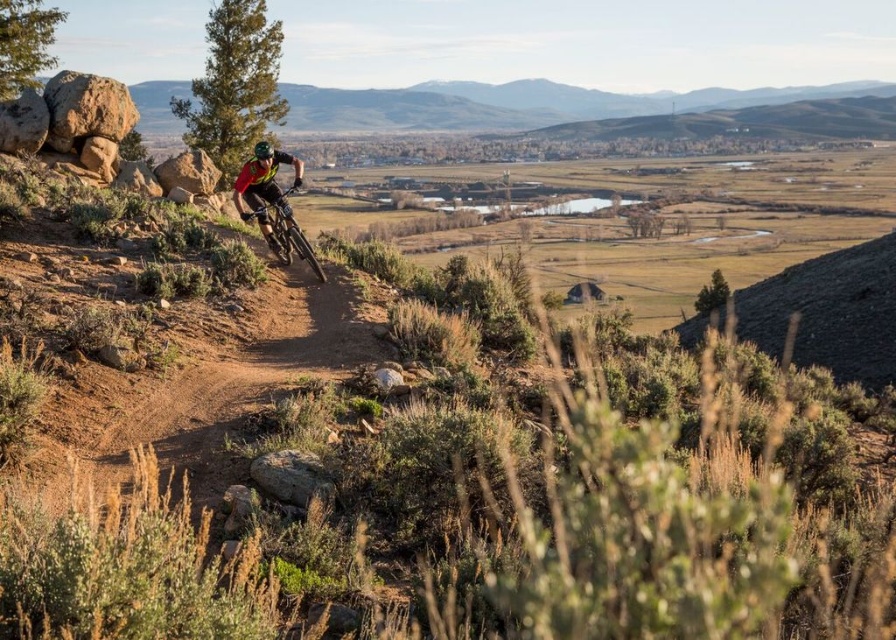
Question: Can you confirm if red fabric helmet at center is positioned to the left of shiny metallic bicycle at center?

Choices:
 (A) no
 (B) yes

Answer: (B)

Question: Observing the image, what is the correct spatial positioning of red fabric helmet at center in reference to shiny metallic bicycle at center?

Choices:
 (A) above
 (B) below

Answer: (A)

Question: Which object appears farthest from the camera in this image?

Choices:
 (A) shiny metallic bicycle at center
 (B) red fabric helmet at center

Answer: (A)

Question: Is red fabric helmet at center positioned behind shiny metallic bicycle at center?

Choices:
 (A) no
 (B) yes

Answer: (A)